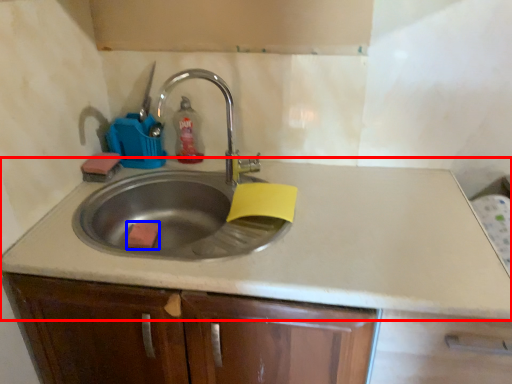
Question: Which point is further to the camera, countertop (highlighted by a red box) or soap (highlighted by a blue box)?

Choices:
 (A) countertop
 (B) soap

Answer: (B)